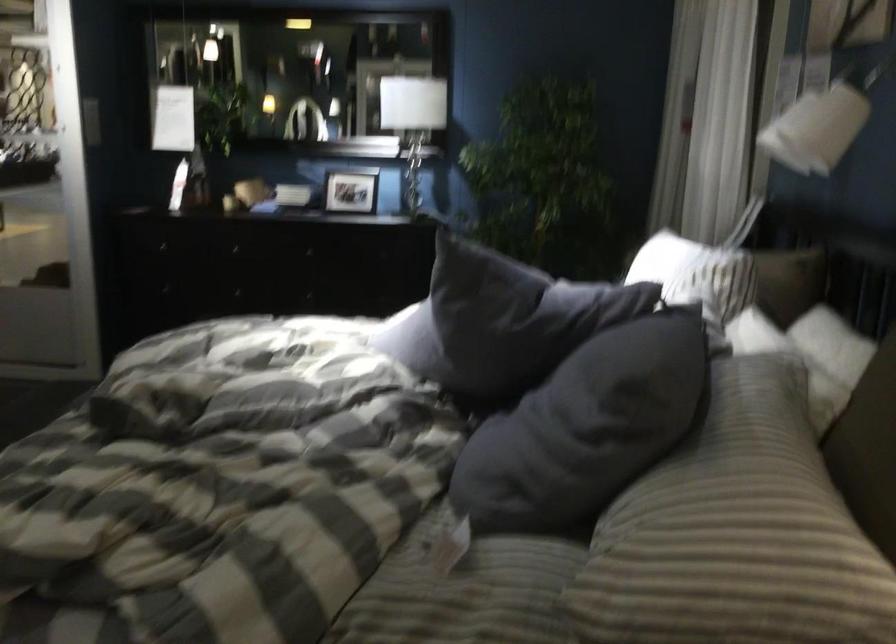
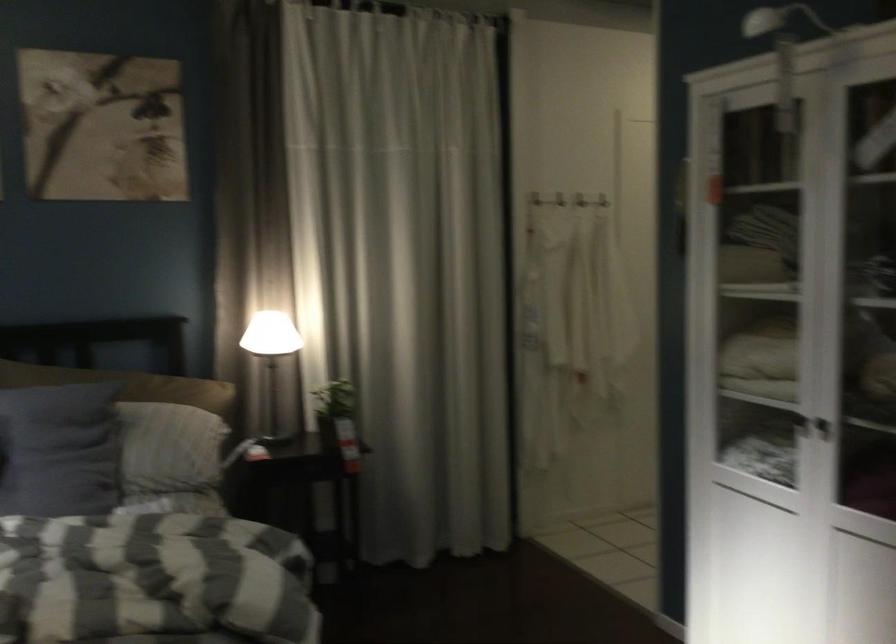
Where in the second image is the point corresponding to [670,520] from the first image?

(173, 442)